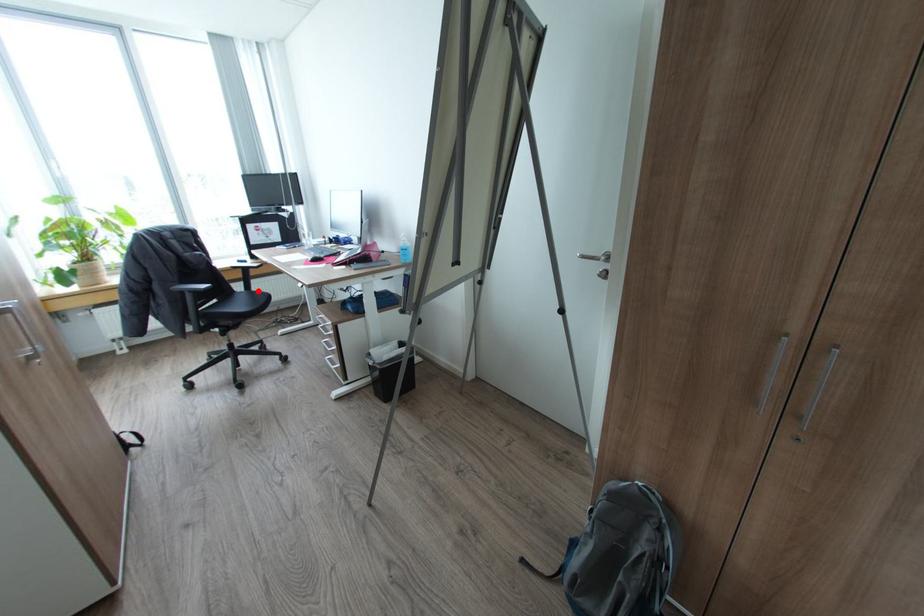
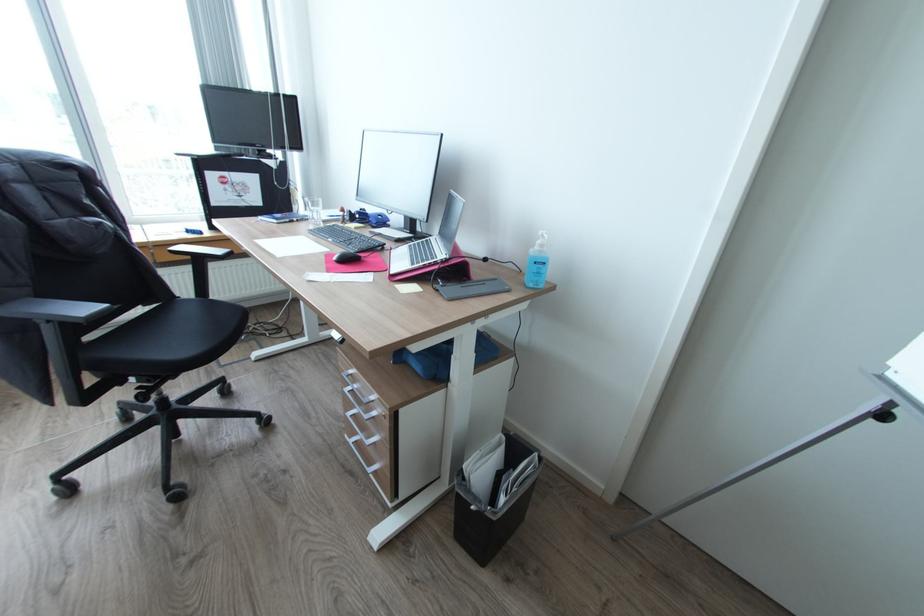
Locate, in the second image, the point that corresponds to the highlighted location in the first image.

(217, 300)